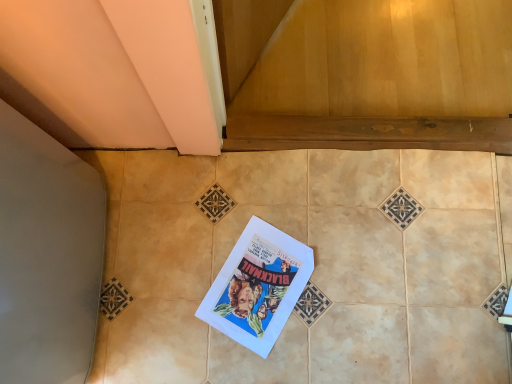
Where is `free location above white paper comic book at center (from a real-world perspective)`? The height and width of the screenshot is (384, 512). free location above white paper comic book at center (from a real-world perspective) is located at coordinates (263, 286).